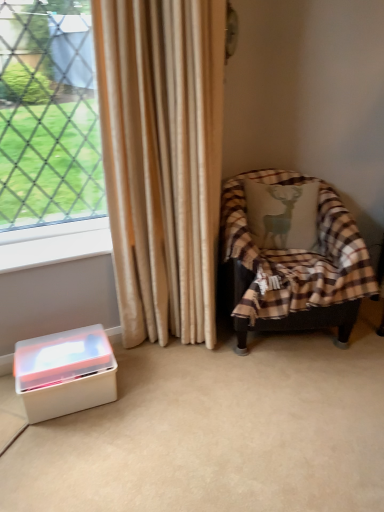
Question: Is plaid fabric chair at right inside or outside of white plastic at lower left?

Choices:
 (A) inside
 (B) outside

Answer: (B)

Question: Looking at the image, does plaid fabric chair at right seem bigger or smaller compared to white plastic at lower left?

Choices:
 (A) small
 (B) big

Answer: (B)

Question: Which of these objects is positioned closest to the white plastic at lower left?

Choices:
 (A) white plastic container at lower left
 (B) plaid fabric chair at right
 (C) beige silk curtain at center

Answer: (C)

Question: Which object is positioned farthest from the beige silk curtain at center?

Choices:
 (A) plaid fabric chair at right
 (B) white plastic at lower left
 (C) white plastic container at lower left

Answer: (C)